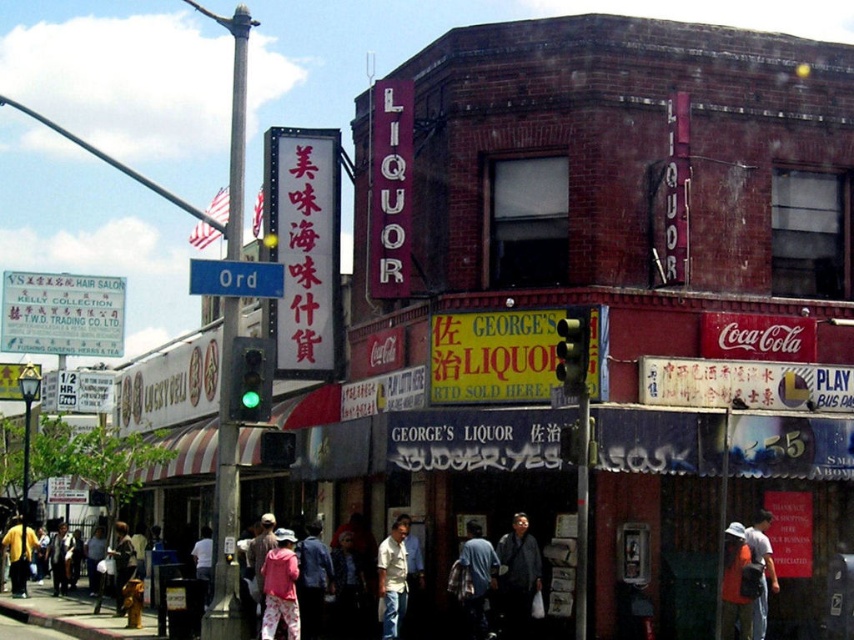
Is dark blue shirt at center further to camera compared to blue metallic street sign at upper center?

That is True.

Does point (518, 556) come closer to viewer compared to point (203, 285)?

No, it is behind (203, 285).

This screenshot has width=854, height=640. In order to click on dark blue shirt at center in this screenshot , I will do `click(518, 577)`.

Identify the location of dark blue shirt at center. (518, 577).

Can you confirm if white paper sign at left is taller than concrete sidewalk at lower left?

Indeed, white paper sign at left has a greater height compared to concrete sidewalk at lower left.

Does white paper sign at left appear under concrete sidewalk at lower left?

No, white paper sign at left is not below concrete sidewalk at lower left.

Is point (22, 282) closer to viewer compared to point (150, 634)?

No, it is not.

Where is `white paper sign at left`? white paper sign at left is located at coordinates (62, 314).

Which of these two, denim jacket at center or orange cotton shirt at lower right, stands taller?

orange cotton shirt at lower right

Consider the image. Between denim jacket at center and orange cotton shirt at lower right, which one is positioned higher?

Positioned higher is orange cotton shirt at lower right.

Does point (472, 604) lie behind point (730, 609)?

Yes, it is behind point (730, 609).

Locate an element on the screen. The height and width of the screenshot is (640, 854). denim jacket at center is located at coordinates (472, 579).